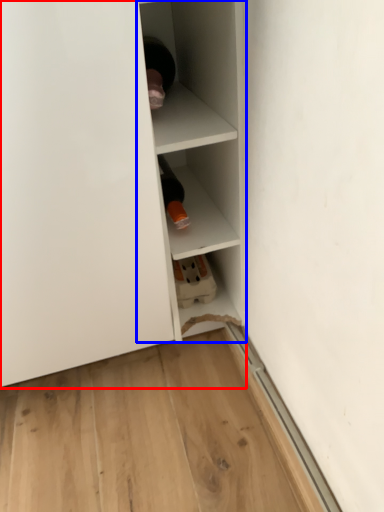
Question: Which of the following is the farthest to the observer, shelf (highlighted by a red box) or shelf (highlighted by a blue box)?

Choices:
 (A) shelf
 (B) shelf

Answer: (B)